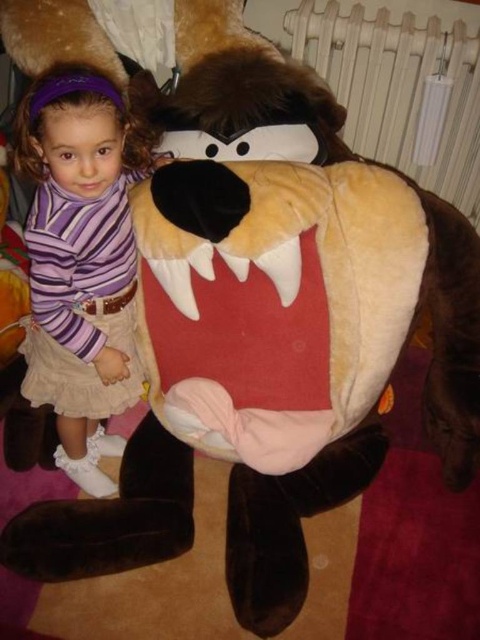
Question: Can you confirm if purple striped shirt at left is bigger than white plastic radiator at upper center?

Choices:
 (A) yes
 (B) no

Answer: (A)

Question: Does purple striped shirt at left appear on the left side of white plastic radiator at upper center?

Choices:
 (A) no
 (B) yes

Answer: (B)

Question: Does purple striped shirt at left have a smaller size compared to white plastic radiator at upper center?

Choices:
 (A) yes
 (B) no

Answer: (B)

Question: Which point is closer to the camera?

Choices:
 (A) (46, 193)
 (B) (465, 176)

Answer: (A)